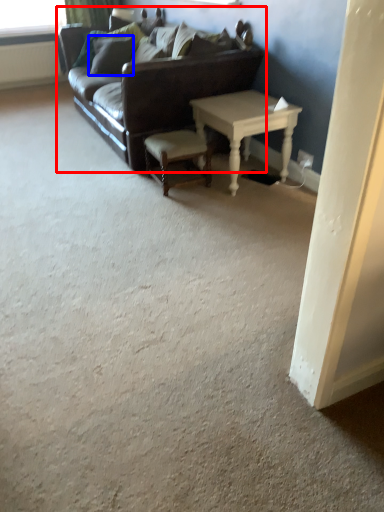
Question: Among these objects, which one is nearest to the camera, studio couch (highlighted by a red box) or pillow (highlighted by a blue box)?

Choices:
 (A) studio couch
 (B) pillow

Answer: (A)